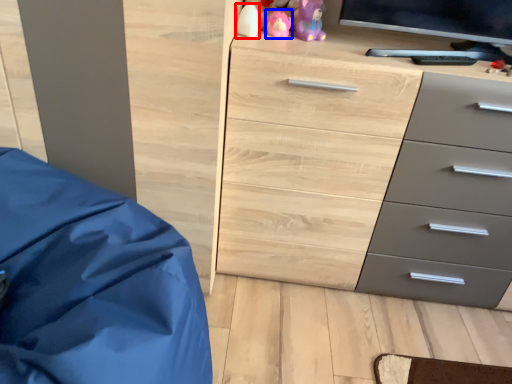
Question: Which of the following is the farthest to the observer, toy (highlighted by a red box) or toy (highlighted by a blue box)?

Choices:
 (A) toy
 (B) toy

Answer: (B)